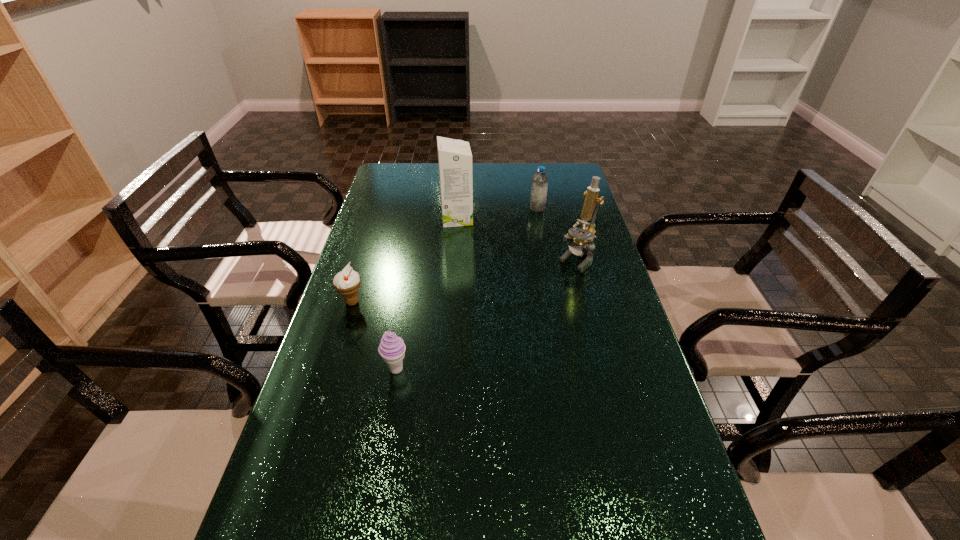
This screenshot has height=540, width=960. I want to click on the third object from left to right, so click(x=454, y=156).

Identify the location of microscope. (579, 236).

Find the location of a particular element. the rightmost object is located at coordinates (579, 236).

This screenshot has width=960, height=540. In order to click on the fourth object from left to right in this screenshot , I will do `click(539, 187)`.

This screenshot has width=960, height=540. Find the location of `water bottle`. water bottle is located at coordinates (539, 187).

Identify the location of the leftmost object. This screenshot has height=540, width=960. [347, 282].

I want to click on the farther icecream, so click(x=347, y=282).

This screenshot has height=540, width=960. What are the coordinates of `the right icecream` in the screenshot? It's located at pyautogui.click(x=392, y=348).

Where is `the second object from left to right`? This screenshot has height=540, width=960. the second object from left to right is located at coordinates (392, 348).

This screenshot has height=540, width=960. In order to click on free spot located 0.090m on the front of the third object from left to right in this screenshot , I will do `click(455, 243)`.